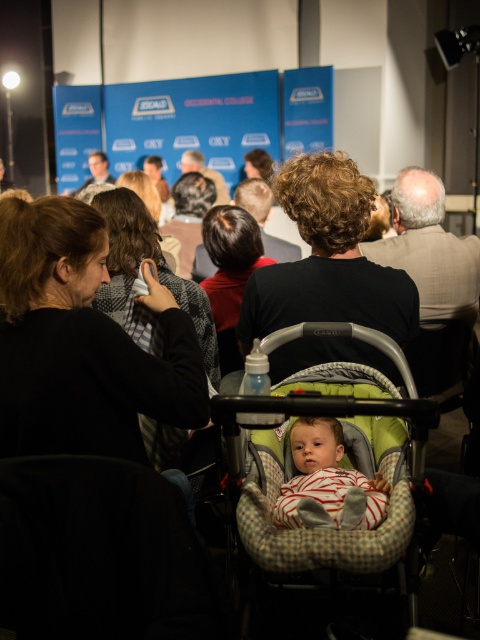
You are a photographer standing at the back of the event space. You want to take a photo of the stage backdrop but need to avoid capturing the plaid fabric baby carriage at center in the frame. Based on the distance between you and the carriage, can you step forward enough to frame the backdrop without the carriage appearing in the shot?

The plaid fabric baby carriage at center is 1.16 meters from the camera. Since you are standing at the back, stepping forward 1.16 meters or more would place you closer than the carriage, potentially allowing you to frame the backdrop without it appearing in the shot. However, this depends on the focal length and angle of your camera lens.

You are a photographer taking pictures of the event. You want to ensure the striped fabric baby at center is fully visible in the photo without being blocked by the plaid fabric baby carriage at center. Given their sizes, is this possible?

The plaid fabric baby carriage at center is bigger than striped fabric baby at center, so there is a risk that the plaid fabric baby carriage at center could block the striped fabric baby at center. Adjust the camera angle to capture the striped fabric baby at center while avoiding obstruction from the larger plaid fabric baby carriage at center.